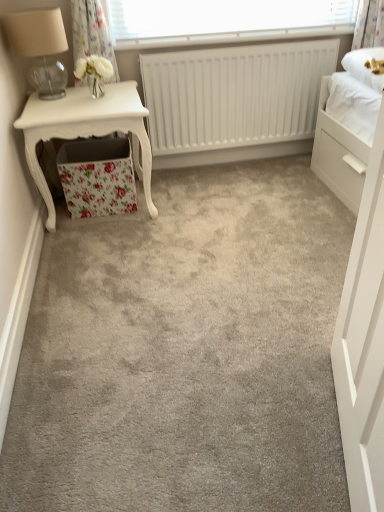
This screenshot has width=384, height=512. What do you see at coordinates (225, 20) in the screenshot?
I see `white textured radiator at upper center` at bounding box center [225, 20].

Measure the distance between point (138, 17) and camera.

Point (138, 17) and camera are 8.12 feet apart from each other.

Identify the location of white textured radiator at upper center. (225, 20).

Image resolution: width=384 pixels, height=512 pixels. I want to click on white textured radiator at upper center, so click(225, 20).